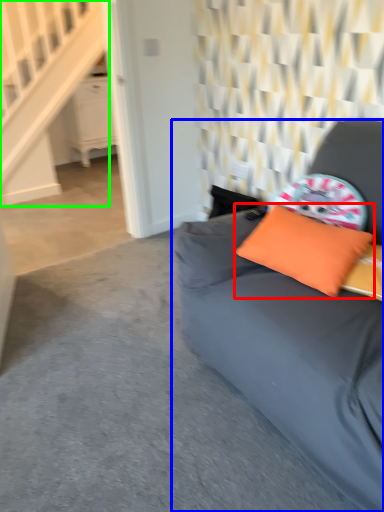
Question: Estimate the real-world distances between objects in this image. Which object is closer to pillow (highlighted by a red box), studio couch (highlighted by a blue box) or stairwell (highlighted by a green box)?

Choices:
 (A) studio couch
 (B) stairwell

Answer: (A)